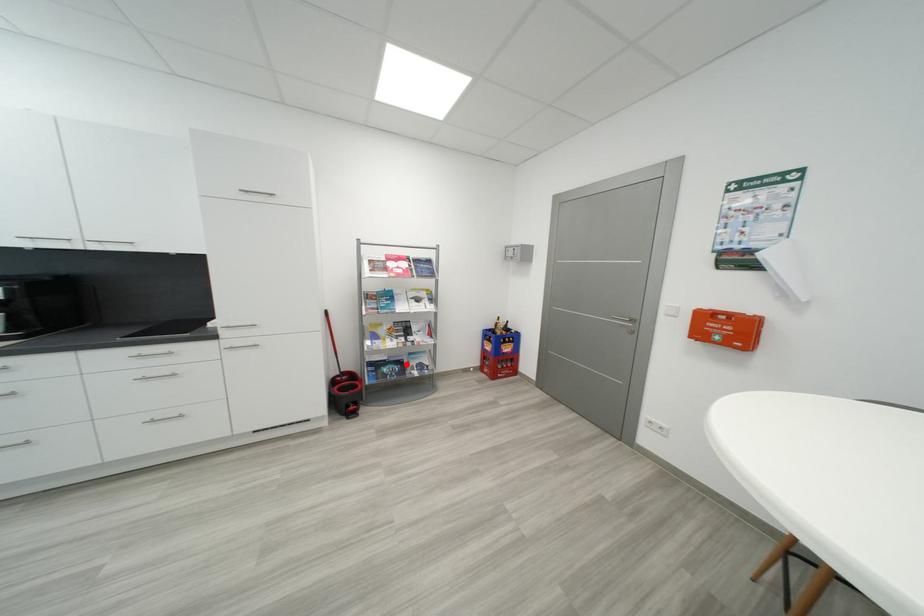
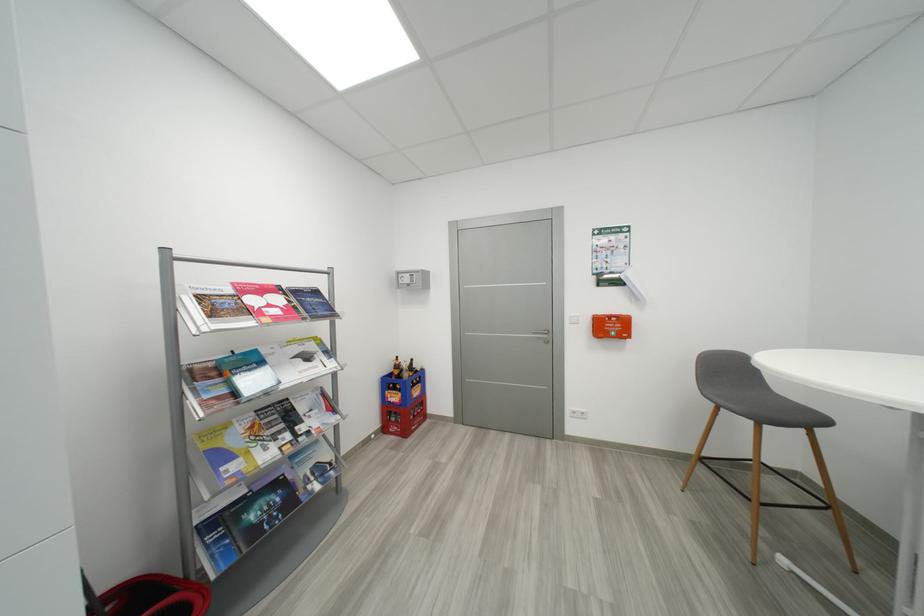
Question: I am providing you with two images of the same scene from different viewpoints. A red point is marked on the first image. At the location where the point appears in image 1, is it still visible in image 2?

Choices:
 (A) Yes
 (B) No

Answer: (A)